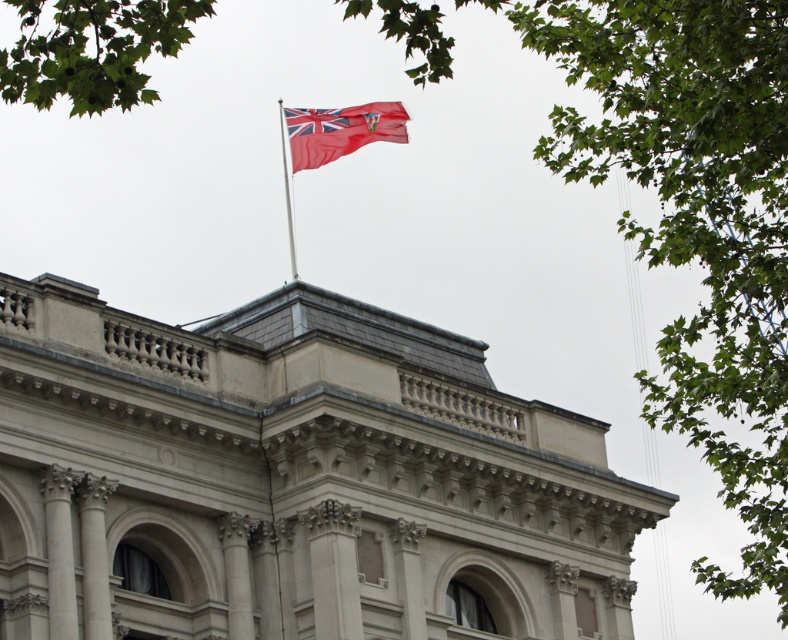
Question: Does red fabric flag at upper center have a greater width compared to silver metallic flag pole at upper center?

Choices:
 (A) no
 (B) yes

Answer: (B)

Question: Among these points, which one is nearest to the camera?

Choices:
 (A) (296, 275)
 (B) (337, 147)

Answer: (B)

Question: Can you confirm if red fabric flag at upper center is smaller than silver metallic flag pole at upper center?

Choices:
 (A) no
 (B) yes

Answer: (A)

Question: In this image, where is red fabric flag at upper center located relative to silver metallic flag pole at upper center?

Choices:
 (A) right
 (B) left

Answer: (A)